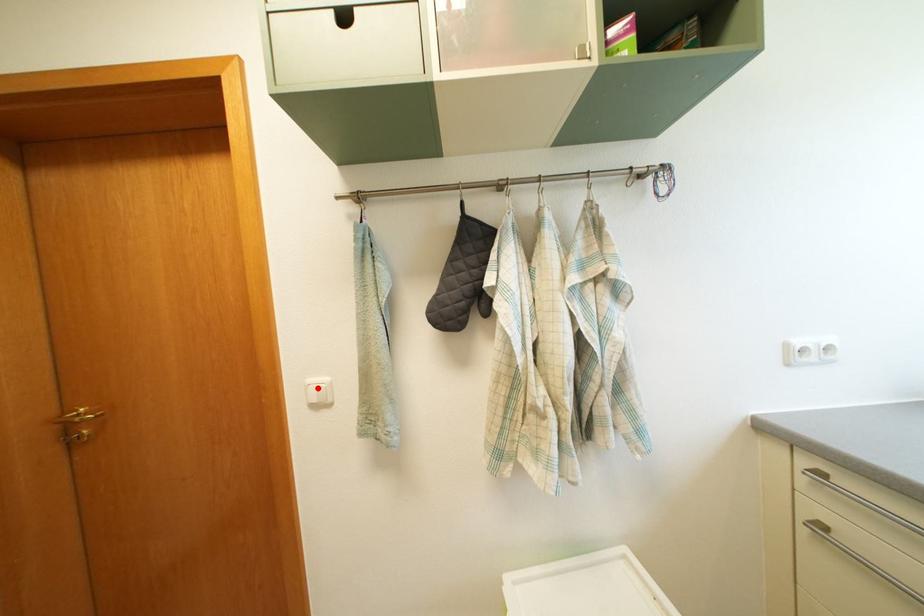
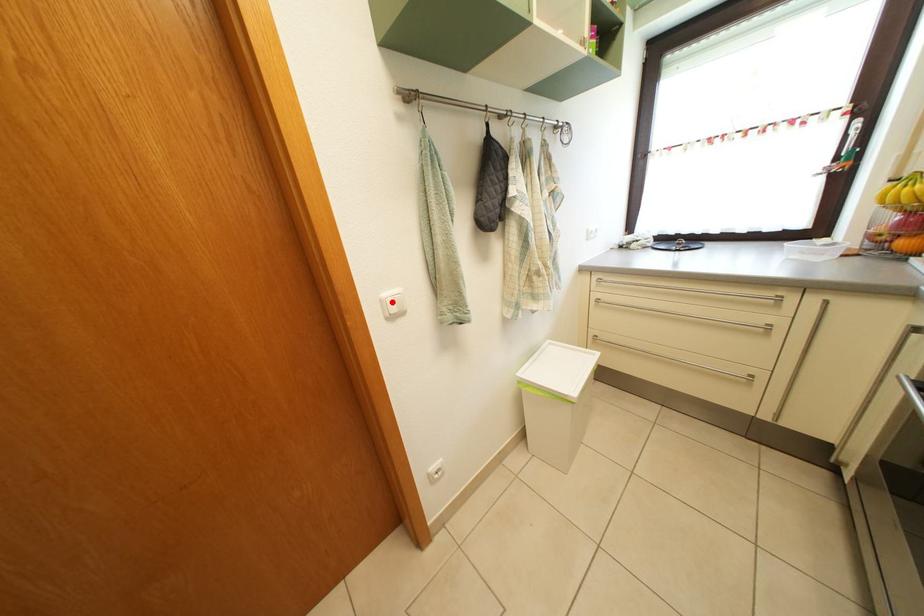
I am providing you with two images of the same scene from different viewpoints. A red point is marked on the first image and another point is marked on the second image. Are the points marked in image1 and image2 representing the same 3D position?

Yes